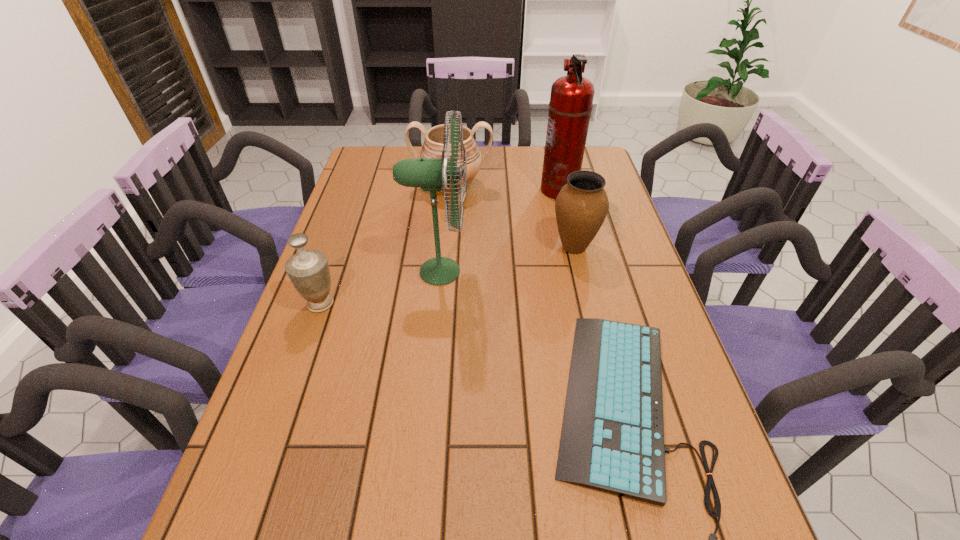
You are a GUI agent. You are given a task and a screenshot of the screen. Output one action in this format:
    pyautogui.click(x=<x>, y=<y>)
    Task: Click on the fire extinguisher
    The image size is (960, 540).
    Given the screenshot: What is the action you would take?
    pyautogui.click(x=570, y=106)

At what (x,y) coordinates should I click in order to perform the action: click on fan. Please return your answer as a coordinate pair (x, y). The image size is (960, 540). Looking at the image, I should click on (430, 174).

Image resolution: width=960 pixels, height=540 pixels. I want to click on the second urn from right to left, so click(x=432, y=147).

You are a GUI agent. You are given a task and a screenshot of the screen. Output one action in this format:
    pyautogui.click(x=<x>, y=<y>)
    Task: Click on the second nearest urn
    
    Given the screenshot: What is the action you would take?
    pyautogui.click(x=581, y=206)

Find the location of a particular element. the nearest urn is located at coordinates (308, 270).

You are a GUI agent. You are given a task and a screenshot of the screen. Output one action in this format:
    pyautogui.click(x=<x>, y=<y>)
    Task: Click on the leftmost urn
    
    Given the screenshot: What is the action you would take?
    pos(308,270)

This screenshot has height=540, width=960. Identify the location of vacant space located on the side of the fire extinguisher with the handle and hose. (502, 190).

Identify the location of vacant space located 0.180m on the side of the fire extinguisher with the handle and hose. (488, 190).

At what (x,y) coordinates should I click in order to perform the action: click on free space located 0.260m on the side of the fire extinguisher with the handle and hose. Please return your answer as a coordinate pair (x, y). Looking at the image, I should click on pos(465,190).

This screenshot has height=540, width=960. In order to click on vacant region located on the front-facing side of the fan in this screenshot , I will do `click(537, 272)`.